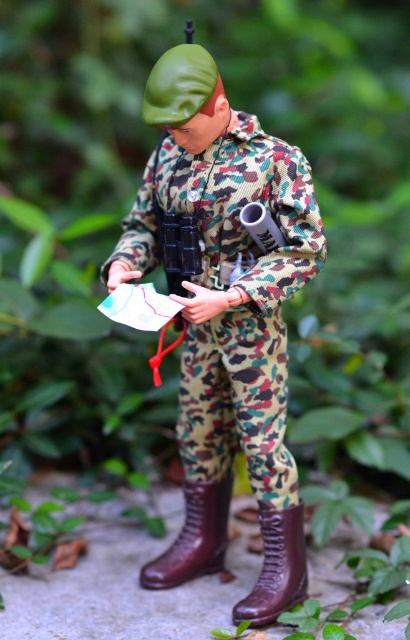
From the picture: You are designing a storage box to fit both the camo fabric uniform at center and the leather at center. Which item requires a wider storage space based on their widths?

The camo fabric uniform at center requires a wider storage space because its width is larger than the leather at center.

You are a collector organizing a display case. You need to place the camo fabric uniform at center in a specific location. According to the coordinates provided, where exactly should you position it?

The camo fabric uniform at center should be positioned at point (225, 316) as specified in the description.